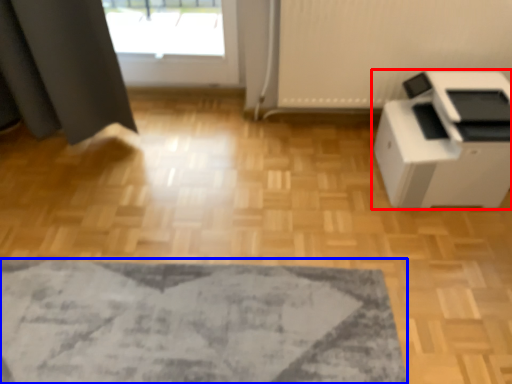
Question: Which point is closer to the camera, home appliance (highlighted by a red box) or mat (highlighted by a blue box)?

Choices:
 (A) home appliance
 (B) mat

Answer: (B)